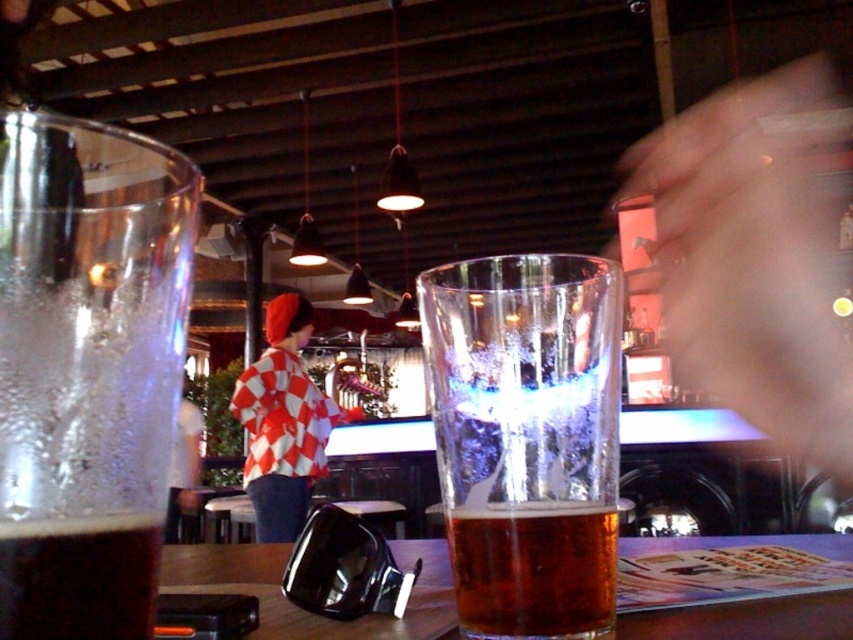
Question: Which object appears farthest from the camera in this image?

Choices:
 (A) red checkered shirt at center
 (B) translucent glass beer at left
 (C) translucent glass beer at center

Answer: (A)

Question: Is translucent glass beer at left bigger than red checkered shirt at center?

Choices:
 (A) yes
 (B) no

Answer: (B)

Question: Which of the following is the closest to the observer?

Choices:
 (A) (128, 132)
 (B) (13, 557)
 (C) (672, 627)

Answer: (B)

Question: Does wooden table at center appear over brown matte beer at lower left?

Choices:
 (A) no
 (B) yes

Answer: (A)

Question: Which of the following is the farthest from the observer?

Choices:
 (A) (782, 621)
 (B) (144, 554)
 (C) (531, 435)

Answer: (A)

Question: Does amber glass beer at center have a smaller size compared to red checkered shirt at center?

Choices:
 (A) no
 (B) yes

Answer: (B)